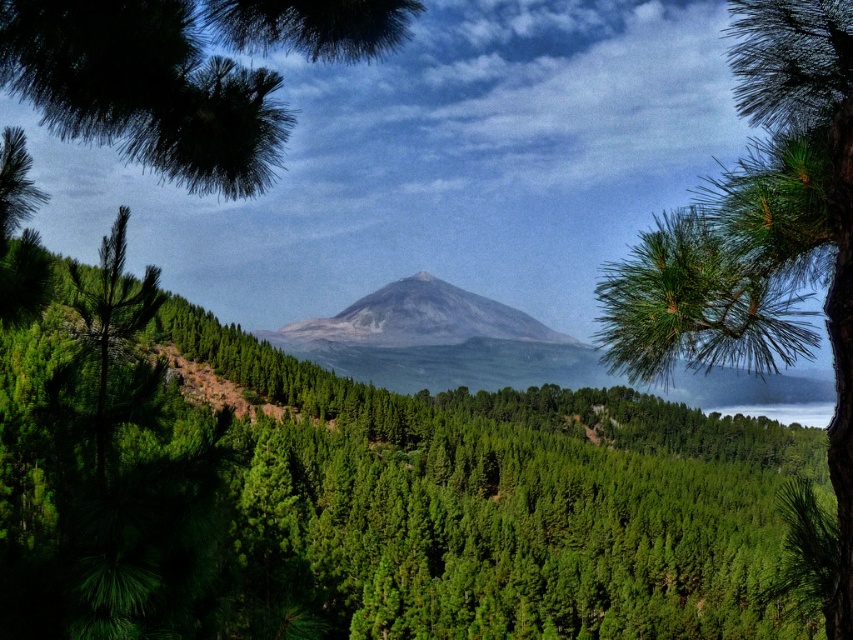
Question: Considering the real-world distances, which object is farthest from the green matte pine branch at upper left?

Choices:
 (A) green needle-like at right
 (B) gray matte mountain at center

Answer: (B)

Question: Does green needle-like at right lie behind gray matte mountain at center?

Choices:
 (A) no
 (B) yes

Answer: (A)

Question: Based on their relative distances, which object is nearer to the gray matte mountain at center?

Choices:
 (A) green matte pine branch at upper left
 (B) green needle-like at right

Answer: (B)

Question: Which is nearer to the green matte pine branch at upper left?

Choices:
 (A) gray matte mountain at center
 (B) green needle-like at right

Answer: (B)

Question: Is green needle-like at right to the right of gray matte mountain at center from the viewer's perspective?

Choices:
 (A) yes
 (B) no

Answer: (A)

Question: Is green needle-like at right smaller than gray matte mountain at center?

Choices:
 (A) yes
 (B) no

Answer: (B)